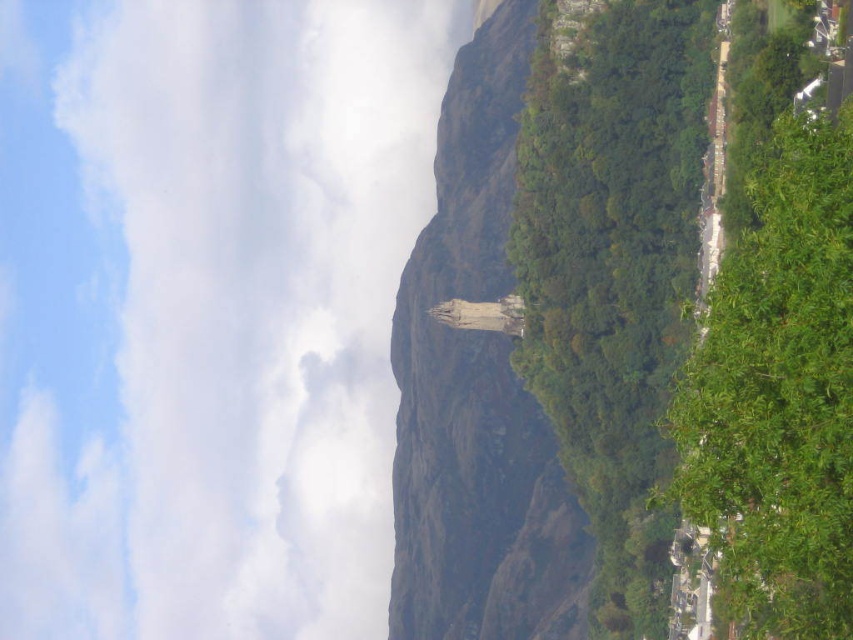
Does green leafy tree at center have a greater height compared to green leafy tree at right?

Indeed, green leafy tree at center has a greater height compared to green leafy tree at right.

Is green leafy tree at center wider than green leafy tree at right?

Indeed, green leafy tree at center has a greater width compared to green leafy tree at right.

Between point (675, 106) and point (743, 541), which one is positioned behind?

Positioned behind is point (675, 106).

Locate an element on the screen. The width and height of the screenshot is (853, 640). green leafy tree at center is located at coordinates (614, 273).

Is the position of white fluffy cloud at upper center more distant than that of green leafy tree at center?

That is True.

Between white fluffy cloud at upper center and green leafy tree at center, which one is positioned lower?

white fluffy cloud at upper center is below.

This screenshot has width=853, height=640. Describe the element at coordinates (206, 308) in the screenshot. I see `white fluffy cloud at upper center` at that location.

Where is `white fluffy cloud at upper center`? The width and height of the screenshot is (853, 640). white fluffy cloud at upper center is located at coordinates (206, 308).

How much distance is there between white fluffy cloud at upper center and green leafy tree at right?

white fluffy cloud at upper center and green leafy tree at right are 423.26 meters apart.

Locate an element on the screen. The width and height of the screenshot is (853, 640). white fluffy cloud at upper center is located at coordinates (206, 308).

The image size is (853, 640). I want to click on white fluffy cloud at upper center, so click(x=206, y=308).

Locate an element on the screen. The image size is (853, 640). white fluffy cloud at upper center is located at coordinates click(206, 308).